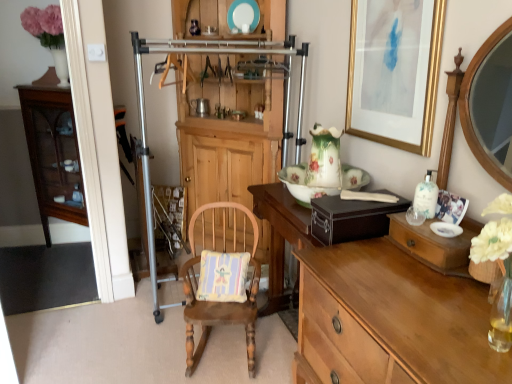
Where is `free space that is to the left of wooden rocking chair with cushion at center`? This screenshot has width=512, height=384. free space that is to the left of wooden rocking chair with cushion at center is located at coordinates (147, 346).